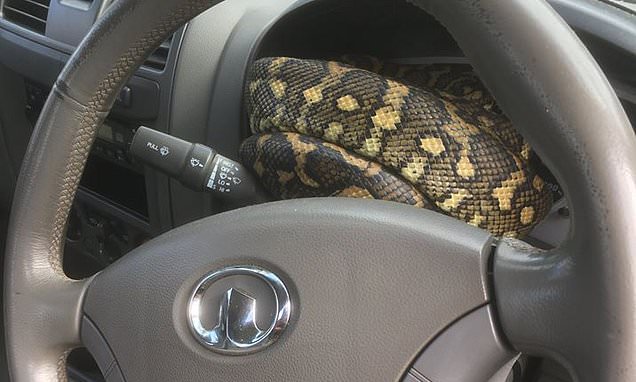
This screenshot has height=382, width=636. Identify the location of stitched leather. (70, 184).